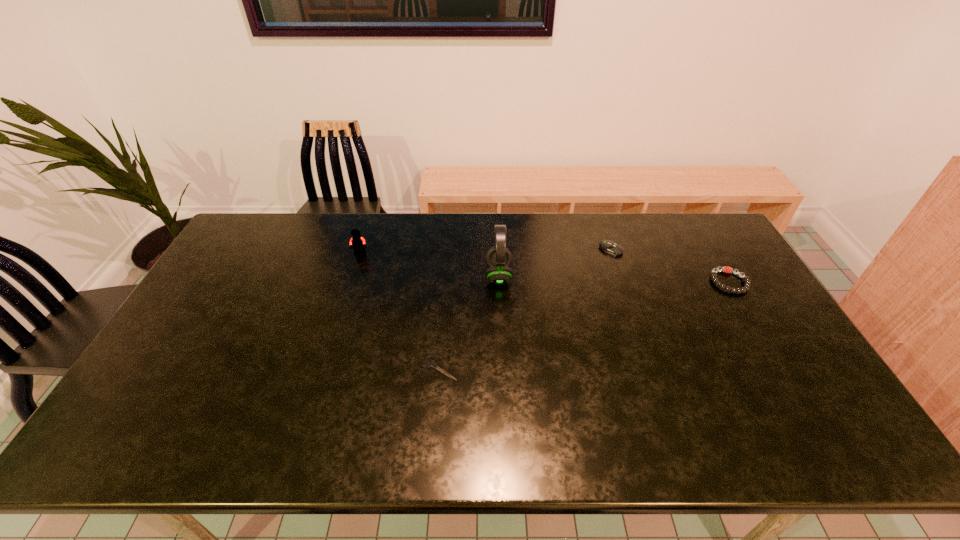
Image resolution: width=960 pixels, height=540 pixels. In order to click on blank region between the leftmost object and the fourth object from left to right in this screenshot , I will do `click(486, 252)`.

You are a GUI agent. You are given a task and a screenshot of the screen. Output one action in this format:
    pyautogui.click(x=<x>, y=<y>)
    Task: Click on the unoccupied position between the third object from right to left and the leftmost object
    
    Given the screenshot: What is the action you would take?
    pyautogui.click(x=429, y=265)

You are a GUI agent. You are given a task and a screenshot of the screen. Output one action in this format:
    pyautogui.click(x=<x>, y=<y>)
    Task: Click on the object that can be found as the closest to the shears
    The width and height of the screenshot is (960, 540).
    Given the screenshot: What is the action you would take?
    pyautogui.click(x=498, y=258)

Image resolution: width=960 pixels, height=540 pixels. In order to click on the second closest object relative to the nearest object in this screenshot , I will do `click(357, 241)`.

You are a GUI agent. You are given a task and a screenshot of the screen. Output one action in this format:
    pyautogui.click(x=<x>, y=<y>)
    Task: Click on the vacant space that satisfies the following two spatial constraints: 1. on the front-facing side of the fourth object from right to left; 2. on the left side of the Lego
    Image resolution: width=960 pixels, height=540 pixels.
    Given the screenshot: What is the action you would take?
    pyautogui.click(x=324, y=368)

The height and width of the screenshot is (540, 960). I want to click on vacant region that satisfies the following two spatial constraints: 1. on the front-facing side of the Lego; 2. on the left side of the rightmost object, so click(351, 282).

This screenshot has height=540, width=960. Identify the location of vacant position in the image that satisfies the following two spatial constraints: 1. on the front side of the second object from right to left; 2. on the left side of the bracelet. (622, 282).

Image resolution: width=960 pixels, height=540 pixels. In order to click on vacant area in the image that satisfies the following two spatial constraints: 1. on the front-facing side of the leftmost object; 2. on the right side of the shortest object in this screenshot , I will do 324,368.

You are a GUI agent. You are given a task and a screenshot of the screen. Output one action in this format:
    pyautogui.click(x=<x>, y=<y>)
    Task: Click on the vacant point that satisfies the following two spatial constraints: 1. on the front-facing side of the second tallest object; 2. on the right side of the bracelet
    Image resolution: width=960 pixels, height=540 pixels.
    Given the screenshot: What is the action you would take?
    pyautogui.click(x=351, y=282)

The width and height of the screenshot is (960, 540). Find the location of `vacant area in the image that satisfies the following two spatial constraints: 1. on the ear cups of the rightmost object; 2. on the left side of the headset`. vacant area in the image that satisfies the following two spatial constraints: 1. on the ear cups of the rightmost object; 2. on the left side of the headset is located at coordinates (499, 282).